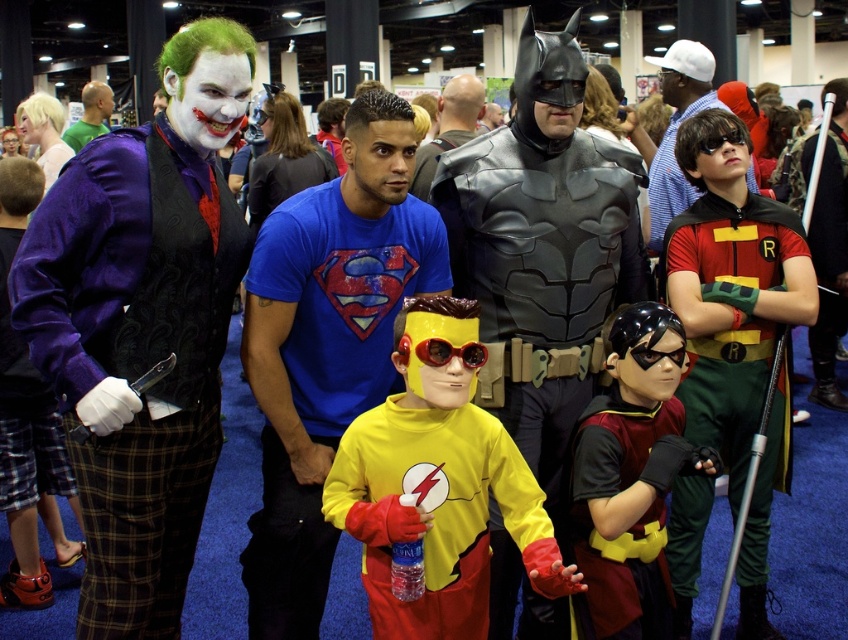
Question: Can you confirm if blue t-shirt at center is smaller than rubberized black glove at center?

Choices:
 (A) no
 (B) yes

Answer: (A)

Question: Which object is positioned farthest from the rubberized black glove at center?

Choices:
 (A) velvet purple vest at left
 (B) shiny black costume at center

Answer: (B)

Question: In this image, where is rubberized black glove at center located relative to smooth black suit at center?

Choices:
 (A) right
 (B) left

Answer: (A)

Question: Is rubberized black glove at center smaller than smooth black suit at center?

Choices:
 (A) yes
 (B) no

Answer: (A)

Question: Which point appears closest to the camera in this image?

Choices:
 (A) (341, 193)
 (B) (656, 408)

Answer: (A)

Question: Which point is farther to the camera?

Choices:
 (A) (495, 426)
 (B) (692, 372)

Answer: (B)